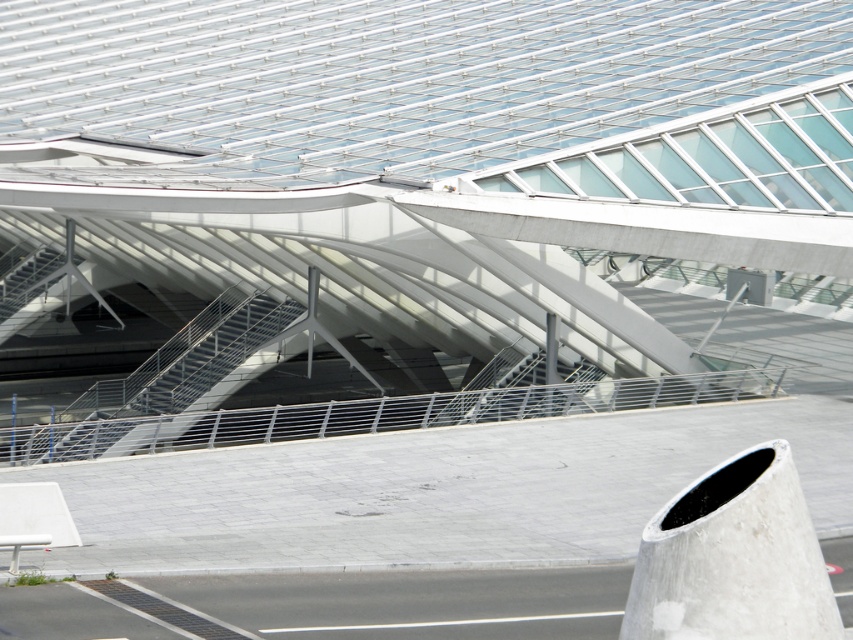
Question: Is metallic gray stairs at center further to the viewer compared to metallic gray stairs at upper left?

Choices:
 (A) no
 (B) yes

Answer: (A)

Question: Which object appears closest to the camera in this image?

Choices:
 (A) metallic gray stairs at upper left
 (B) metallic gray stairs at center
 (C) metallic gray stair at center

Answer: (B)

Question: Where is metallic gray stair at center located in relation to metallic gray stairs at upper left in the image?

Choices:
 (A) left
 (B) right

Answer: (B)

Question: Which point is farther from the camera taking this photo?

Choices:
 (A) (573, 396)
 (B) (1, 288)

Answer: (B)

Question: Which of these objects is positioned farthest from the metallic gray stairs at center?

Choices:
 (A) metallic gray stair at center
 (B) metallic gray stairs at upper left

Answer: (B)

Question: Does metallic gray stair at center appear under metallic gray stairs at upper left?

Choices:
 (A) yes
 (B) no

Answer: (A)